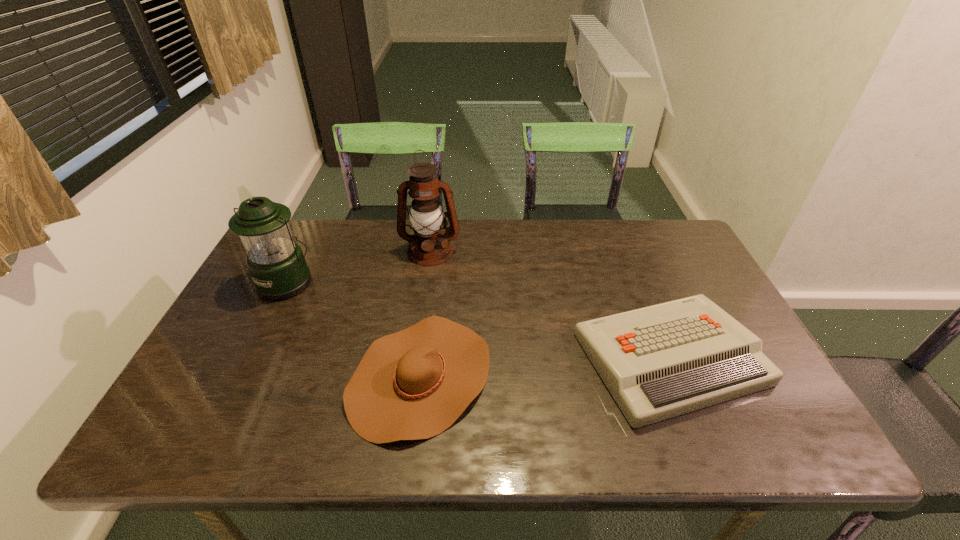
Where is `computer keyboard that is positioned at the near edge`? computer keyboard that is positioned at the near edge is located at coordinates (658, 362).

The height and width of the screenshot is (540, 960). I want to click on cowboy hat that is at the near edge, so click(x=414, y=384).

Image resolution: width=960 pixels, height=540 pixels. Identify the location of object that is at the left edge. (276, 263).

Find the location of a particular element. This screenshot has width=960, height=540. object located in the right edge section of the desktop is located at coordinates (x=658, y=362).

Image resolution: width=960 pixels, height=540 pixels. What are the coordinates of `object that is at the far left corner` in the screenshot? It's located at (276, 263).

Identify the location of object at the near right corner. (658, 362).

I want to click on blank space at the far edge of the desktop, so click(386, 244).

The image size is (960, 540). I want to click on vacant space at the near edge of the desktop, so tap(361, 447).

This screenshot has height=540, width=960. In order to click on free space at the left edge of the desktop in this screenshot , I will do `click(262, 355)`.

The image size is (960, 540). In the image, there is a desktop. What are the coordinates of `vacant space at the right edge` in the screenshot? It's located at (681, 298).